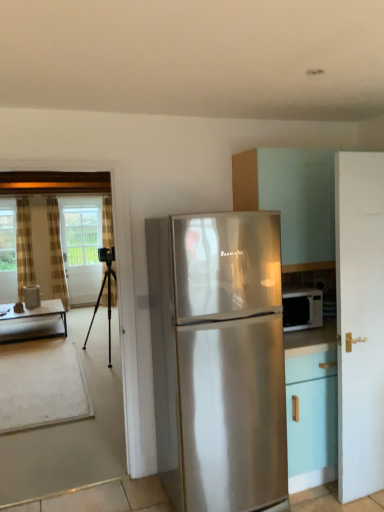
Question: Is white glossy cabinet at upper right in front of or behind satin silver refrigerator at center in the image?

Choices:
 (A) behind
 (B) front

Answer: (A)

Question: Is white glossy cabinet at upper right inside or outside of satin silver refrigerator at center?

Choices:
 (A) inside
 (B) outside

Answer: (B)

Question: Which is nearer to the striped fabric curtain at left, which is the third curtain in right-to-left order?

Choices:
 (A) white glossy water at left
 (B) plaid fabric curtain at left, the first curtain positioned from the right
 (C) black metal tripod at left
 (D) white matte door at right
 (E) satin silver refrigerator at center

Answer: (A)

Question: Which object is the farthest from the white glossy cabinet at upper right?

Choices:
 (A) white glass screen door at left
 (B) plaid fabric curtain at left, which ranks as the third curtain in left-to-right order
 (C) striped fabric curtain at left, which is the third curtain in right-to-left order
 (D) white matte door at right
 (E) wooden table at left

Answer: (C)